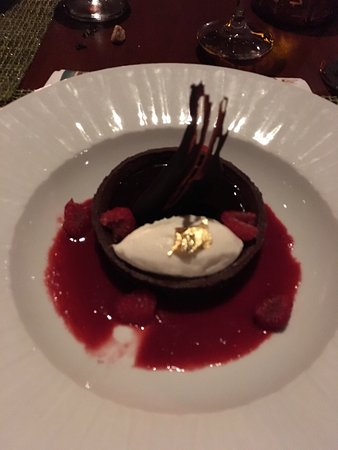
This screenshot has height=450, width=338. I want to click on placemat, so [16, 37].